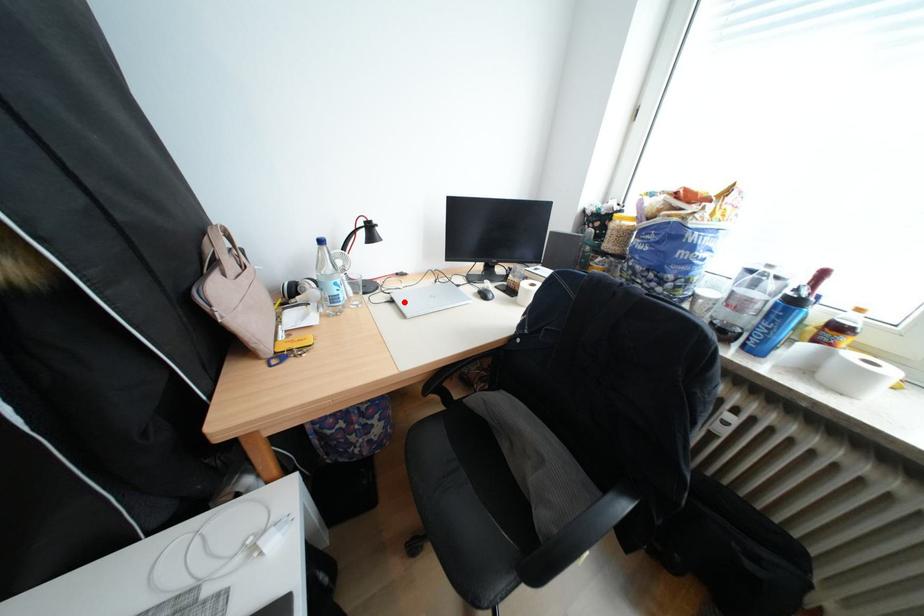
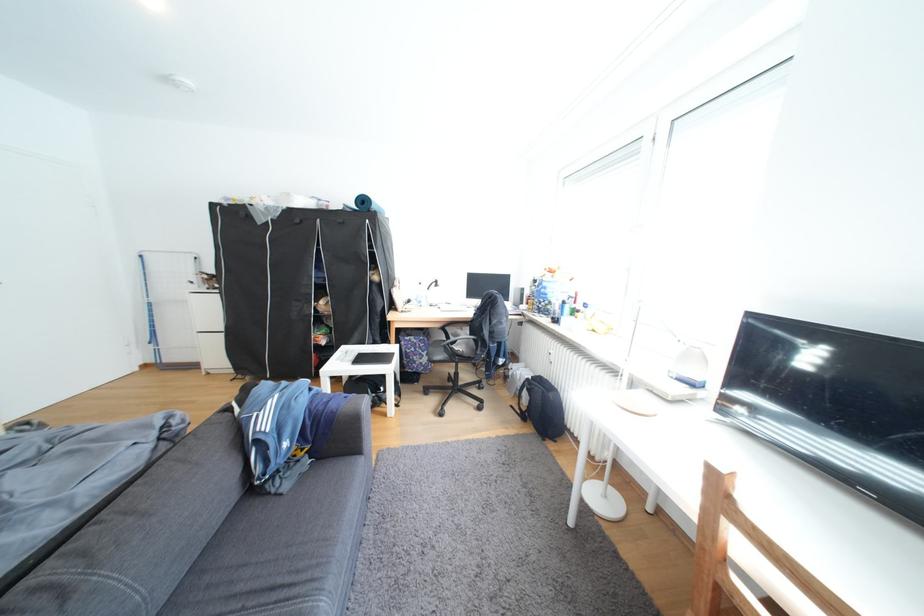
Question: I am providing you with two images of the same scene from different viewpoints. A red point is marked on the first image. Can you still see the location of the red point in image 2?

Choices:
 (A) Yes
 (B) No

Answer: (B)